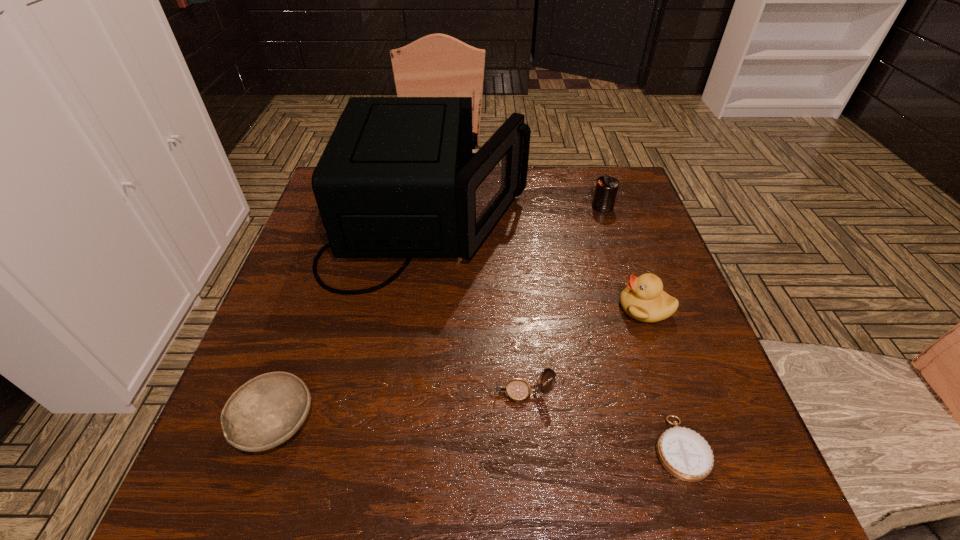
Locate an element on the screen. This screenshot has width=960, height=540. unoccupied area between the taller compass and the bowl is located at coordinates (399, 408).

Locate an element on the screen. free spot between the can and the left compass is located at coordinates (563, 299).

At what (x,y) coordinates should I click in order to perform the action: click on free spot between the left compass and the duckling. Please return your answer as a coordinate pair (x, y). Image resolution: width=960 pixels, height=540 pixels. Looking at the image, I should click on (584, 350).

This screenshot has height=540, width=960. In order to click on free spot between the right compass and the bowl in this screenshot , I will do `click(478, 435)`.

Where is `free spot between the can and the duckling`? free spot between the can and the duckling is located at coordinates (624, 257).

The height and width of the screenshot is (540, 960). Identify the location of vacant area that lies between the duckling and the bowl. (460, 366).

Locate an element on the screen. vacant space that's between the can and the bowl is located at coordinates (439, 314).

Identify which object is located as the second nearest to the nearer compass. Please provide its 2D coordinates. Your answer should be formatted as a tuple, i.e. [(x, y)], where the tuple contains the x and y coordinates of a point satisfying the conditions above.

[(643, 299)]

Point out which object is positioned as the nearest to the taller compass. Please provide its 2D coordinates. Your answer should be formatted as a tuple, i.e. [(x, y)], where the tuple contains the x and y coordinates of a point satisfying the conditions above.

[(685, 454)]

Image resolution: width=960 pixels, height=540 pixels. I want to click on free space that satisfies the following two spatial constraints: 1. on the front side of the can; 2. with the door open on the tallest object, so click(x=608, y=222).